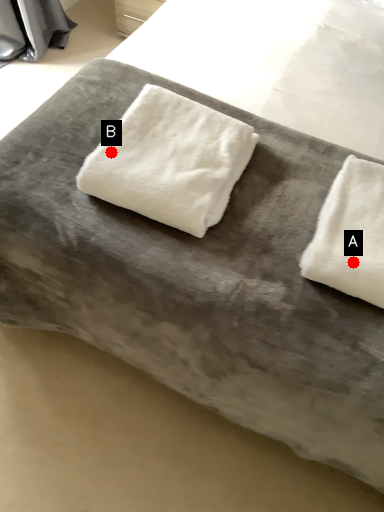
Question: Two points are circled on the image, labeled by A and B beside each circle. Which point is closer to the camera taking this photo?

Choices:
 (A) A is closer
 (B) B is closer

Answer: (A)